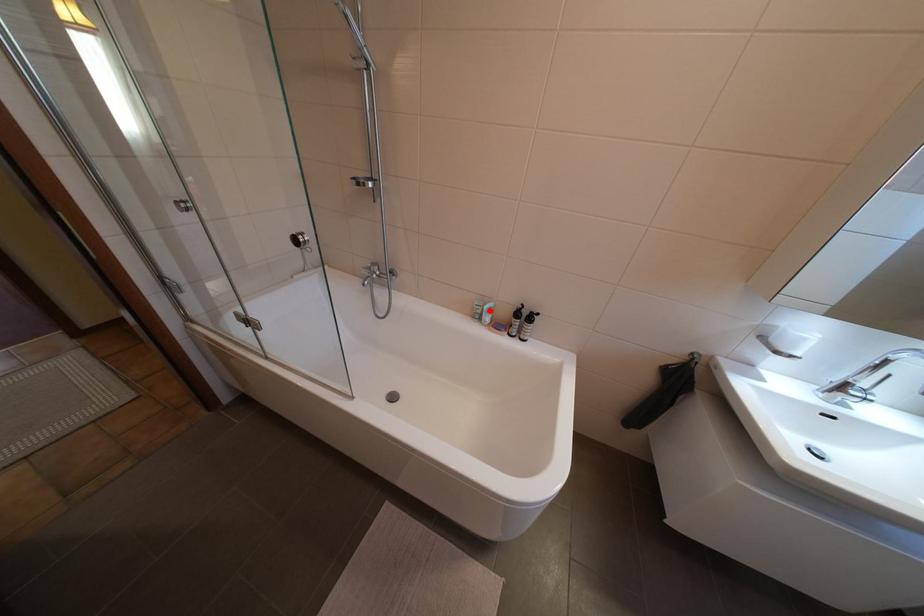
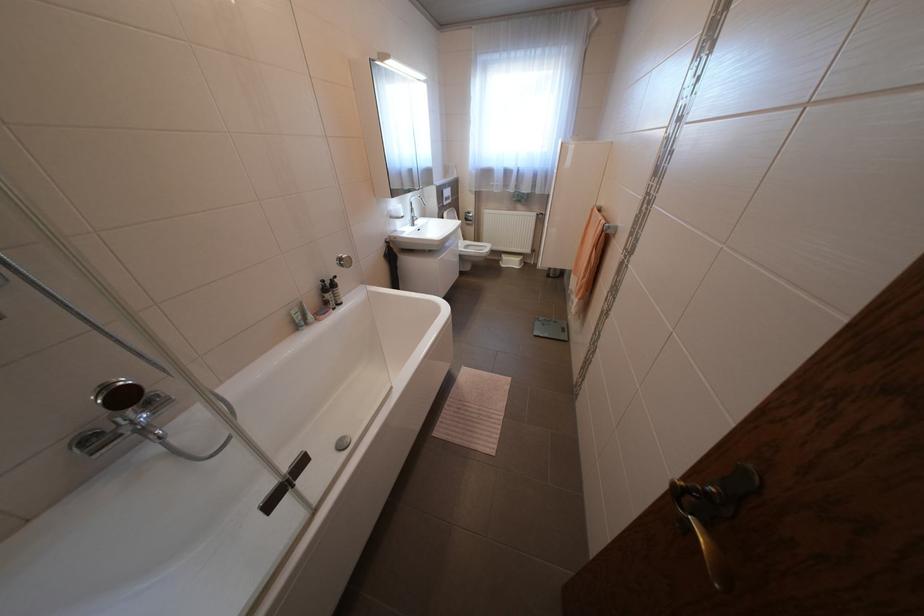
Question: I am providing you with two images of the same scene from different viewpoints. A red point is shown in image1. For the corresponding object point in image2, is it positioned nearer or farther from the camera?

Choices:
 (A) Nearer
 (B) Farther

Answer: (A)